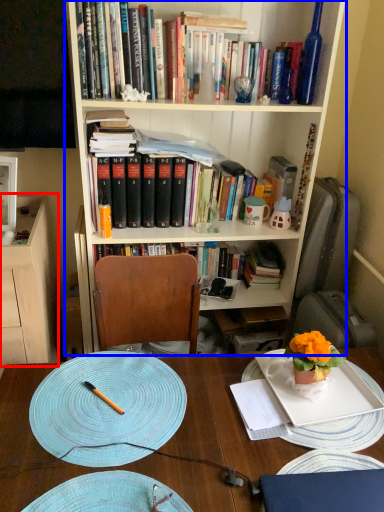
Question: Among these objects, which one is farthest to the camera, cabinetry (highlighted by a red box) or bookcase (highlighted by a blue box)?

Choices:
 (A) cabinetry
 (B) bookcase

Answer: (A)